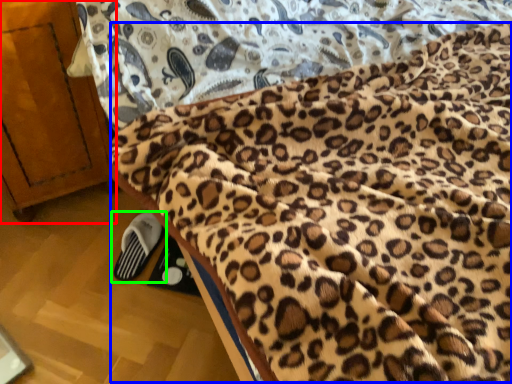
Question: Which object is positioned farthest from furniture (highlighted by a red box)? Select from blanket (highlighted by a blue box) and footwear (highlighted by a green box).

Choices:
 (A) blanket
 (B) footwear

Answer: (A)